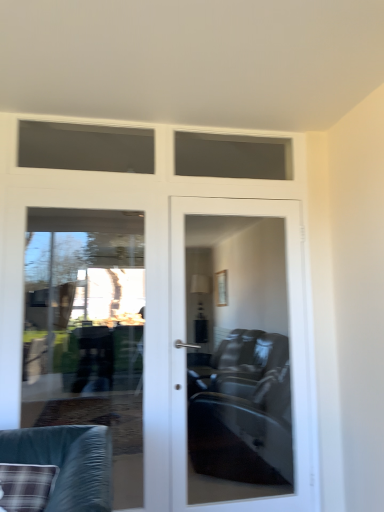
Question: Is matte glass door at center in front of or behind plaid fabric cushion at lower left in the image?

Choices:
 (A) behind
 (B) front

Answer: (A)

Question: Considering the positions of matte glass door at center and plaid fabric cushion at lower left in the image, is matte glass door at center taller or shorter than plaid fabric cushion at lower left?

Choices:
 (A) tall
 (B) short

Answer: (A)

Question: Considering the real-world distances, which object is farthest from the matte glass door at center?

Choices:
 (A) clear glass door at left
 (B) plaid fabric cushion at lower left

Answer: (B)

Question: Considering the real-world distances, which object is farthest from the matte glass door at center?

Choices:
 (A) clear glass door at left
 (B) plaid fabric cushion at lower left

Answer: (B)